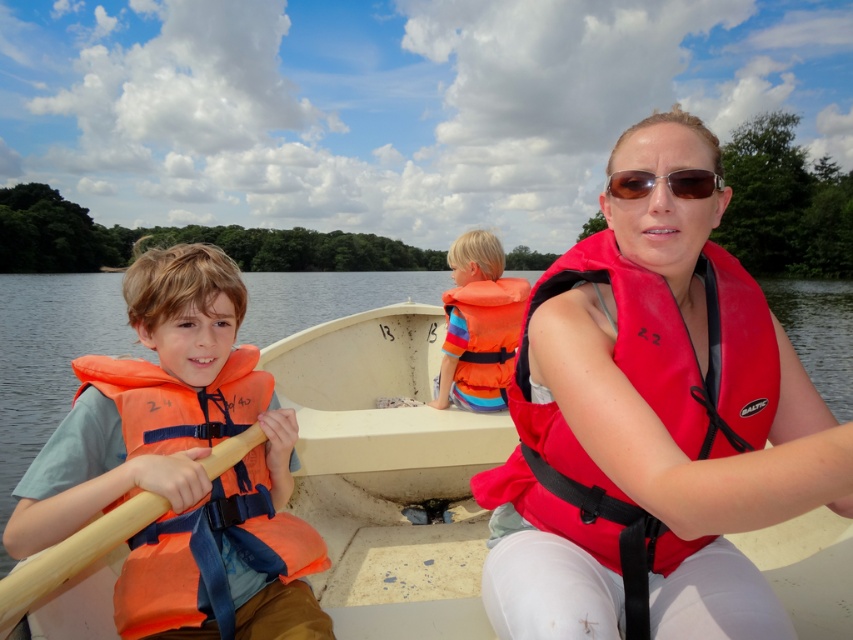
Who is shorter, orange life vest at left or matte brown sunglasses at center?

With less height is matte brown sunglasses at center.

Is orange life vest at left taller than matte brown sunglasses at center?

Yes, orange life vest at left is taller than matte brown sunglasses at center.

Which is behind, point (206, 307) or point (722, 182)?

Point (206, 307)

Locate an element on the screen. The width and height of the screenshot is (853, 640). orange life vest at left is located at coordinates (183, 465).

Between point (671, 406) and point (364, 339), which one is positioned behind?

Point (364, 339)

Does point (700, 253) come in front of point (346, 353)?

Yes, it is.

At what (x,y) coordinates should I click in order to perform the action: click on matte red life vest at center. Please return your answer as a coordinate pair (x, y). The image size is (853, 640). Looking at the image, I should click on (653, 436).

Locate an element on the screen. This screenshot has width=853, height=640. matte red life vest at center is located at coordinates (653, 436).

Is orange life vest at left positioned before orange fabric life jacket at center?

That is True.

Is point (117, 476) farther from viewer compared to point (457, 385)?

No, (117, 476) is in front of (457, 385).

You are a GUI agent. You are given a task and a screenshot of the screen. Output one action in this format:
    pyautogui.click(x=<x>, y=<y>)
    Task: Click on the orange life vest at left
    
    Given the screenshot: What is the action you would take?
    pyautogui.click(x=183, y=465)